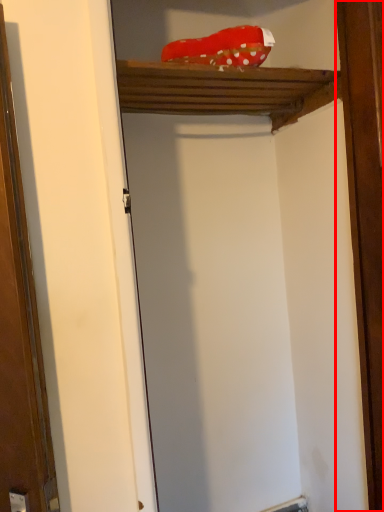
Question: Considering the relative positions of barn door (annotated by the red box) and cabinet in the image provided, where is barn door (annotated by the red box) located with respect to the staircase?

Choices:
 (A) left
 (B) right

Answer: (B)